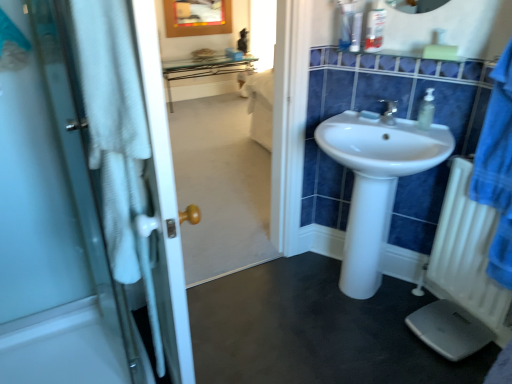
Question: Considering the relative sizes of white glossy sink at center and clear plastic cup at upper center, marked as the second toiletry in a left-to-right arrangement, in the image provided, is white glossy sink at center smaller than clear plastic cup at upper center, marked as the second toiletry in a left-to-right arrangement,?

Choices:
 (A) yes
 (B) no

Answer: (B)

Question: Considering the relative sizes of white glossy sink at center and clear plastic cup at upper center, which is counted as the second toiletry, starting from the right, in the image provided, is white glossy sink at center bigger than clear plastic cup at upper center, which is counted as the second toiletry, starting from the right,?

Choices:
 (A) no
 (B) yes

Answer: (B)

Question: From a real-world perspective, is white glossy sink at center located beneath clear plastic cup at upper center, which is counted as the second toiletry, starting from the right?

Choices:
 (A) no
 (B) yes

Answer: (B)

Question: Is white glossy sink at center positioned before clear plastic cup at upper center, which is counted as the second toiletry, starting from the right?

Choices:
 (A) yes
 (B) no

Answer: (A)

Question: From the image's perspective, would you say white glossy sink at center is positioned over clear plastic cup at upper center, marked as the second toiletry in a left-to-right arrangement?

Choices:
 (A) no
 (B) yes

Answer: (A)

Question: Is white glossy sink at center positioned beyond the bounds of clear plastic cup at upper center, marked as the second toiletry in a left-to-right arrangement?

Choices:
 (A) no
 (B) yes

Answer: (B)

Question: Does white plastic scale at lower right have a greater height compared to translucent plastic bottle at upper right, which appears as the first toiletry when viewed from the right?

Choices:
 (A) no
 (B) yes

Answer: (A)

Question: Does white plastic scale at lower right contain translucent plastic bottle at upper right, which appears as the first toiletry when viewed from the right?

Choices:
 (A) no
 (B) yes

Answer: (A)

Question: Considering the relative positions of white plastic scale at lower right and translucent plastic bottle at upper right, which ranks as the third toiletry in left-to-right order, in the image provided, is white plastic scale at lower right to the right of translucent plastic bottle at upper right, which ranks as the third toiletry in left-to-right order, from the viewer's perspective?

Choices:
 (A) yes
 (B) no

Answer: (A)

Question: Is white plastic scale at lower right wider than translucent plastic bottle at upper right, which ranks as the third toiletry in left-to-right order?

Choices:
 (A) yes
 (B) no

Answer: (A)

Question: Is white plastic scale at lower right smaller than translucent plastic bottle at upper right, which ranks as the third toiletry in left-to-right order?

Choices:
 (A) no
 (B) yes

Answer: (A)

Question: Is white plastic scale at lower right completely or partially outside of translucent plastic bottle at upper right, which appears as the first toiletry when viewed from the right?

Choices:
 (A) yes
 (B) no

Answer: (A)

Question: From the image's perspective, does black rubber mat at lower center appear lower than white glass door at left?

Choices:
 (A) no
 (B) yes

Answer: (B)